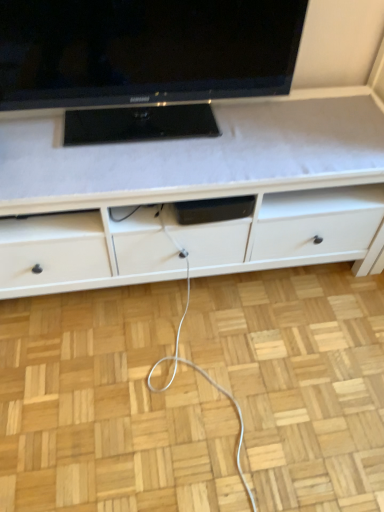
Question: Considering the relative sizes of black glossy tv at upper center and white matte cabinet at center in the image provided, is black glossy tv at upper center taller than white matte cabinet at center?

Choices:
 (A) yes
 (B) no

Answer: (B)

Question: Does black glossy tv at upper center have a smaller size compared to white matte cabinet at center?

Choices:
 (A) yes
 (B) no

Answer: (A)

Question: Considering the relative sizes of black glossy tv at upper center and white matte cabinet at center in the image provided, is black glossy tv at upper center shorter than white matte cabinet at center?

Choices:
 (A) no
 (B) yes

Answer: (B)

Question: Does black glossy tv at upper center appear on the right side of white matte cabinet at center?

Choices:
 (A) yes
 (B) no

Answer: (B)

Question: Is black glossy tv at upper center positioned with its back to white matte cabinet at center?

Choices:
 (A) no
 (B) yes

Answer: (A)

Question: From the image's perspective, is black glossy tv at upper center on top of white matte cabinet at center?

Choices:
 (A) no
 (B) yes

Answer: (B)

Question: Is white matte cabinet at center positioned far away from black glossy tv at upper center?

Choices:
 (A) yes
 (B) no

Answer: (B)

Question: From a real-world perspective, is white matte cabinet at center located beneath black glossy tv at upper center?

Choices:
 (A) yes
 (B) no

Answer: (A)

Question: Considering the relative positions of white matte cabinet at center and black glossy tv at upper center in the image provided, is white matte cabinet at center to the left of black glossy tv at upper center from the viewer's perspective?

Choices:
 (A) no
 (B) yes

Answer: (A)

Question: Is white matte cabinet at center further to camera compared to black glossy tv at upper center?

Choices:
 (A) yes
 (B) no

Answer: (A)

Question: Is white matte cabinet at center located outside black glossy tv at upper center?

Choices:
 (A) yes
 (B) no

Answer: (A)

Question: Does white matte cabinet at center touch black glossy tv at upper center?

Choices:
 (A) no
 (B) yes

Answer: (A)

Question: Is white matte cabinet at center inside or outside of black glossy tv at upper center?

Choices:
 (A) outside
 (B) inside

Answer: (A)